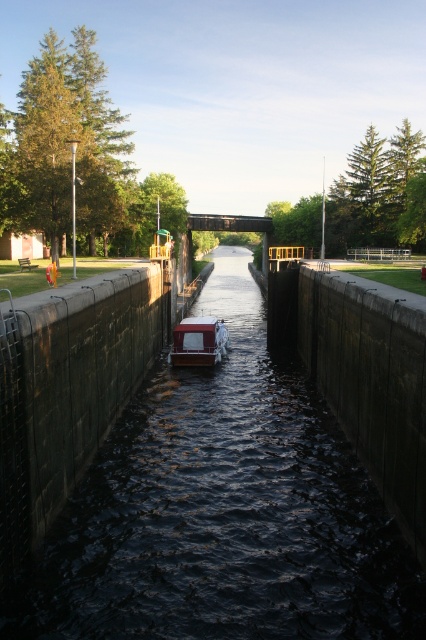
You are a boat operator trying to navigate through the canal lock system. You see the dark concrete waterway at center and the white glossy boat at center. Which direction should you steer your boat to align with the waterway?

You should steer your boat to the right because the dark concrete waterway at center is to the right of the white glossy boat at center.

You are a boat operator trying to navigate your white glossy boat at center through the dark concrete waterway at center. Based on the size comparison between the boat and the waterway, can you safely maneuver the boat through the waterway without touching the sides?

The dark concrete waterway at center is larger in size than the white glossy boat at center, so yes, the boat can safely maneuver through the waterway without touching the sides.

You are navigating a small boat through a canal lock. There are two points marked on your map at coordinates point (37, 554) and point (192, 364). Which point should you aim for first to follow the correct path through the lock?

You should aim for point (37, 554) first because it is in front of point (192, 364) along the path through the lock.